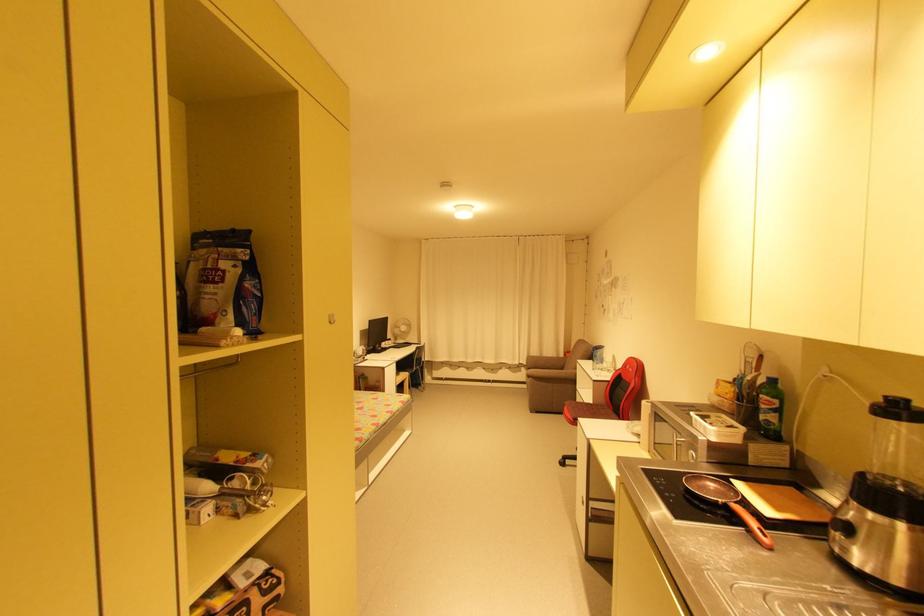
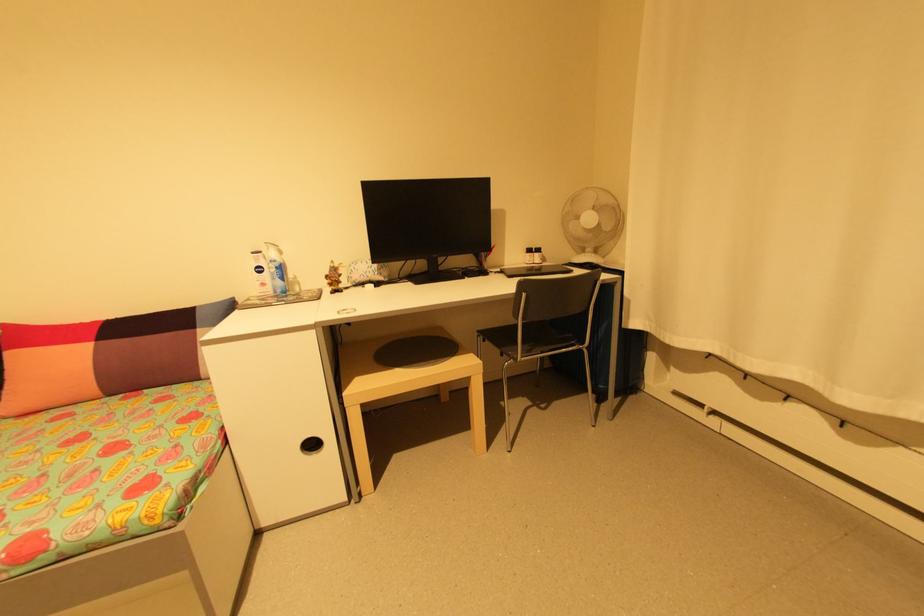
In the second image, find the point that corresponds to the point at 406,339 in the first image.

(600, 252)